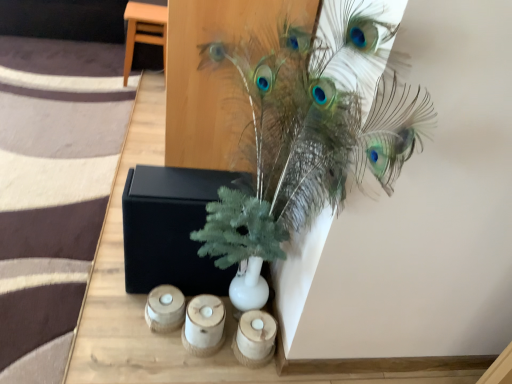
Find the location of a particular element. free space in front of wooden candle holder at lower center, which is the third candle holder from right to left is located at coordinates (144, 354).